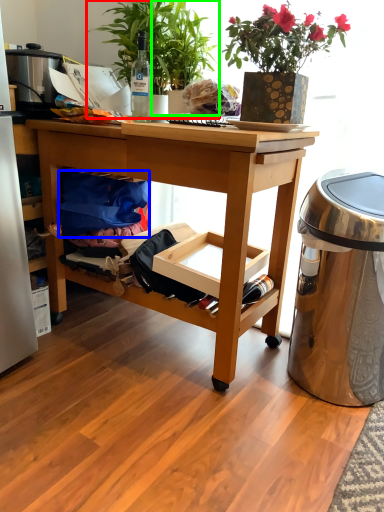
Question: Which object is the closest to the houseplant (highlighted by a red box)? Choose among these: material (highlighted by a blue box) or houseplant (highlighted by a green box).

Choices:
 (A) material
 (B) houseplant

Answer: (B)